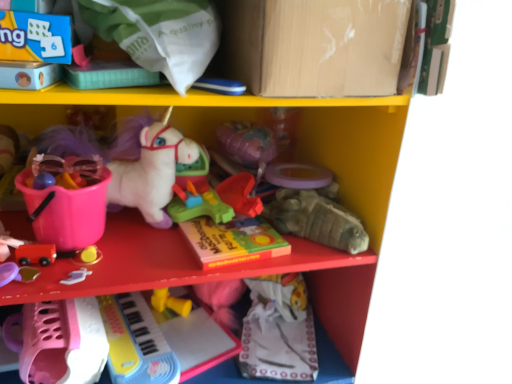
Question: Is the depth of rubberized plastic toy at center, positioned as the 1th toy in top-to-bottom order, less than that of smooth wooden car at lower left, the fourth toy when ordered from top to bottom?

Choices:
 (A) no
 (B) yes

Answer: (A)

Question: Is rubberized plastic toy at center, positioned as the 1th toy in top-to-bottom order, outside smooth wooden car at lower left, the fourth toy when ordered from top to bottom?

Choices:
 (A) yes
 (B) no

Answer: (A)

Question: Does rubberized plastic toy at center, which is the sixth toy from bottom to top, lie behind smooth wooden car at lower left, the fourth toy when ordered from top to bottom?

Choices:
 (A) no
 (B) yes

Answer: (B)

Question: From the image's perspective, is rubberized plastic toy at center, which is the sixth toy from bottom to top, on top of smooth wooden car at lower left, which is the third toy from bottom to top?

Choices:
 (A) no
 (B) yes

Answer: (B)

Question: Is smooth wooden car at lower left, the fourth toy when ordered from top to bottom, completely or partially inside rubberized plastic toy at center, positioned as the 1th toy in top-to-bottom order?

Choices:
 (A) no
 (B) yes

Answer: (A)

Question: Could you tell me if rubberized plastic toy at center, positioned as the 1th toy in top-to-bottom order, is facing smooth wooden car at lower left, the fourth toy when ordered from top to bottom?

Choices:
 (A) yes
 (B) no

Answer: (B)

Question: Is matte gray turtle at center right, positioned as the third toy in top-to-bottom order, facing away from rubberized plastic toy at center, arranged as the 5th toy when ordered from the bottom?

Choices:
 (A) yes
 (B) no

Answer: (B)

Question: Does matte gray turtle at center right, which is counted as the 4th toy, starting from the bottom, turn towards rubberized plastic toy at center, arranged as the 5th toy when ordered from the bottom?

Choices:
 (A) no
 (B) yes

Answer: (A)

Question: Is matte gray turtle at center right, positioned as the third toy in top-to-bottom order, outside of rubberized plastic toy at center, arranged as the 5th toy when ordered from the bottom?

Choices:
 (A) yes
 (B) no

Answer: (A)

Question: Is matte gray turtle at center right, which is counted as the 4th toy, starting from the bottom, smaller than rubberized plastic toy at center, arranged as the 5th toy when ordered from the bottom?

Choices:
 (A) no
 (B) yes

Answer: (A)

Question: Does matte gray turtle at center right, positioned as the third toy in top-to-bottom order, have a lesser height compared to rubberized plastic toy at center, arranged as the 5th toy when ordered from the bottom?

Choices:
 (A) no
 (B) yes

Answer: (A)

Question: Is matte gray turtle at center right, which is counted as the 4th toy, starting from the bottom, touching rubberized plastic toy at center, which is the second toy from top to bottom?

Choices:
 (A) no
 (B) yes

Answer: (A)

Question: Does matte plastic book at center have a smaller size compared to matte cardboard box at upper center?

Choices:
 (A) yes
 (B) no

Answer: (A)